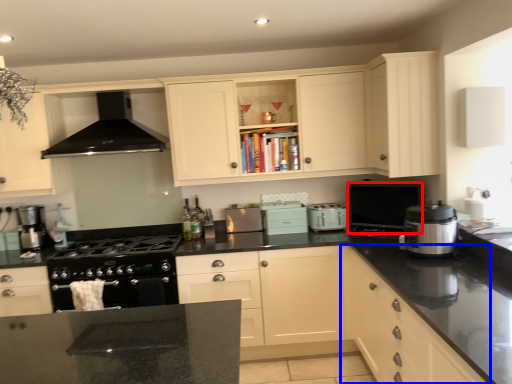
Question: Which object appears closest to the camera in this image, appliance (highlighted by a red box) or cabinetry (highlighted by a blue box)?

Choices:
 (A) appliance
 (B) cabinetry

Answer: (B)